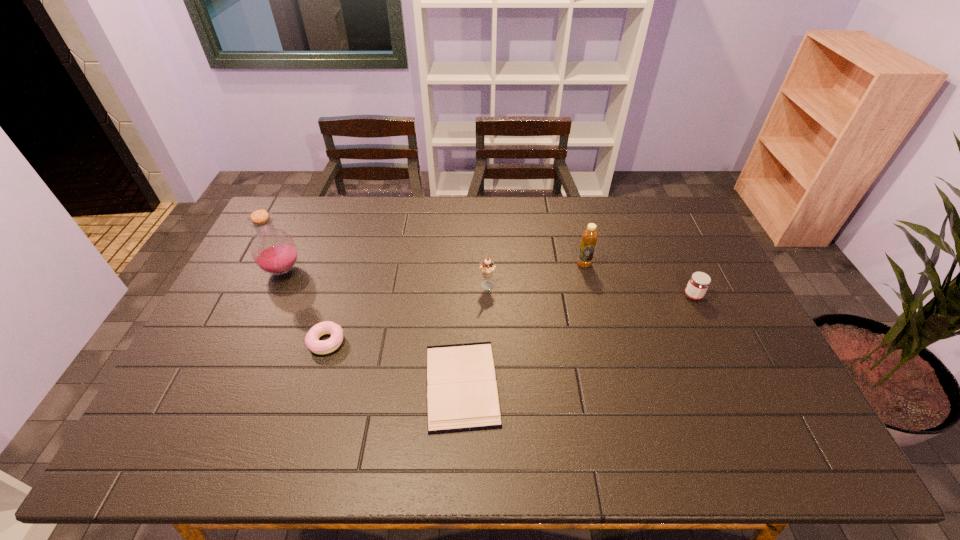
I want to click on vacant area situated on the back of the left bottle, so click(x=316, y=198).

Where is `vacant space located 0.100m on the right of the shorter bottle`? vacant space located 0.100m on the right of the shorter bottle is located at coordinates pos(621,264).

At what (x,y) coordinates should I click in order to perform the action: click on free space located 0.200m on the front of the third tallest object. Please return your answer as a coordinate pair (x, y). The height and width of the screenshot is (540, 960). Looking at the image, I should click on (489, 347).

Locate an element on the screen. The image size is (960, 540). free space located on the left of the rightmost object is located at coordinates (554, 296).

Locate an element on the screen. free space located 0.160m on the back of the fifth tallest object is located at coordinates (343, 288).

Find the location of a particular element. Image resolution: width=960 pixels, height=540 pixels. free location located on the back of the shortest object is located at coordinates (466, 279).

Where is `object positioned at the near edge`? object positioned at the near edge is located at coordinates (462, 395).

In order to click on object located at the left edge in this screenshot , I will do `click(273, 250)`.

Find the location of a particular element. The image size is (960, 540). object located at the right edge is located at coordinates (699, 282).

The height and width of the screenshot is (540, 960). Identify the location of vacant area at the far edge of the desktop. (548, 214).